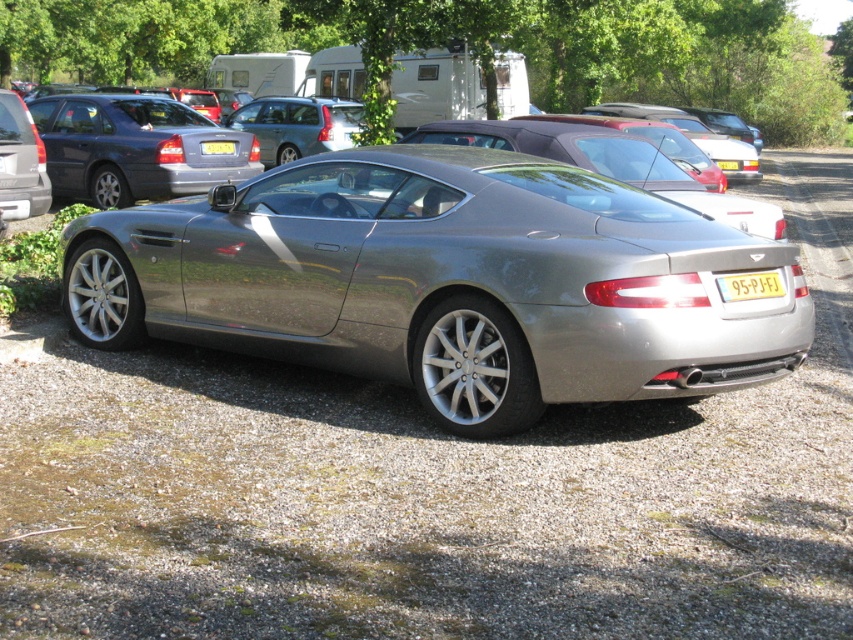
Between satin silver car at center and matte silver car at left, which one is positioned higher?

matte silver car at left

Which is more to the right, satin silver car at center or matte silver car at left?

satin silver car at center

Is point (520, 376) farther from camera compared to point (39, 188)?

No, (520, 376) is in front of (39, 188).

Locate an element on the screen. The width and height of the screenshot is (853, 640). satin silver car at center is located at coordinates (445, 282).

Who is shorter, yellow metallic license plate at center or yellow plastic license plate at center?

yellow metallic license plate at center

Is yellow metallic license plate at center shorter than yellow plastic license plate at center?

Yes, yellow metallic license plate at center is shorter than yellow plastic license plate at center.

Is point (761, 282) closer to viewer compared to point (225, 154)?

Yes.

You are a GUI agent. You are given a task and a screenshot of the screen. Output one action in this format:
    pyautogui.click(x=<x>, y=<y>)
    Task: Click on the yellow metallic license plate at center
    
    Given the screenshot: What is the action you would take?
    pyautogui.click(x=750, y=285)

Who is positioned more to the left, matte gray sedan at center or yellow plastic license plate at center?

Positioned to the left is matte gray sedan at center.

In the scene shown: Can you confirm if matte gray sedan at center is taller than yellow plastic license plate at center?

Yes.

Is point (186, 147) behind point (234, 144)?

No, it is not.

Identify the location of matte gray sedan at center. The height and width of the screenshot is (640, 853). (134, 148).